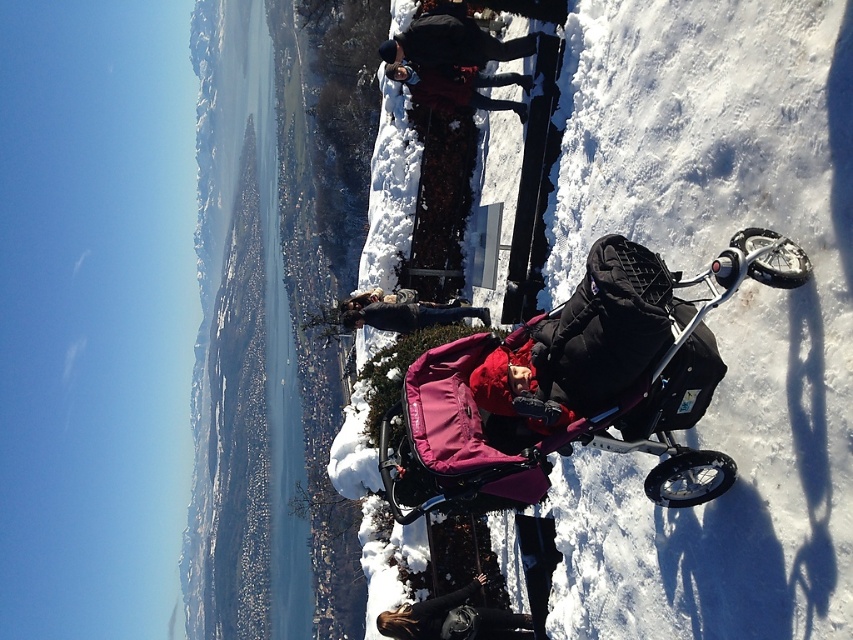
Does purple fabric stroller at center have a lesser width compared to dark blue jacket at upper center?

Yes, purple fabric stroller at center is thinner than dark blue jacket at upper center.

Measure the distance between point (525,444) and camera.

13.95 meters

Locate an element on the screen. This screenshot has height=640, width=853. purple fabric stroller at center is located at coordinates (577, 385).

Which of these two, black leather jacket at lower center or matte black jacket at center, stands shorter?

With less height is black leather jacket at lower center.

Who is higher up, black leather jacket at lower center or matte black jacket at center?

Positioned higher is matte black jacket at center.

You are a GUI agent. You are given a task and a screenshot of the screen. Output one action in this format:
    pyautogui.click(x=<x>, y=<y>)
    Task: Click on the black leather jacket at lower center
    
    Given the screenshot: What is the action you would take?
    pyautogui.click(x=453, y=618)

The width and height of the screenshot is (853, 640). Find the location of `black leather jacket at lower center`. black leather jacket at lower center is located at coordinates (453, 618).

Between black leather jacket at lower center and dark blue jacket at upper center, which one is positioned lower?

black leather jacket at lower center is below.

Which is more to the right, black leather jacket at lower center or dark blue jacket at upper center?

From the viewer's perspective, black leather jacket at lower center appears more on the right side.

Identify the location of black leather jacket at lower center. This screenshot has width=853, height=640. (453, 618).

Locate an element on the screen. The image size is (853, 640). black leather jacket at lower center is located at coordinates [x=453, y=618].